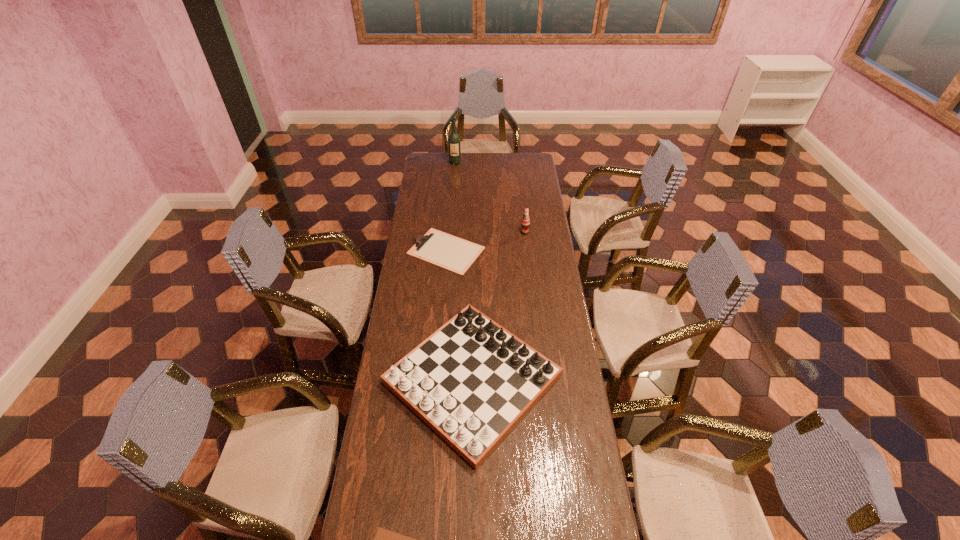
I want to click on object present at the far edge, so click(454, 140).

This screenshot has width=960, height=540. I want to click on gameboard that is at the left edge, so click(472, 381).

Where is `clipboard at the left edge`? This screenshot has height=540, width=960. clipboard at the left edge is located at coordinates (447, 251).

Image resolution: width=960 pixels, height=540 pixels. In order to click on soda that is at the right edge in this screenshot , I will do `click(525, 222)`.

Where is `gameboard that is at the right edge`? The image size is (960, 540). gameboard that is at the right edge is located at coordinates (472, 381).

In order to click on free location at the left edge of the desktop in this screenshot , I will do `click(443, 177)`.

Identify the location of blank space at the right edge. (526, 186).

This screenshot has width=960, height=540. I want to click on free space at the far left corner, so click(441, 169).

Where is `free space between the soda and the gameboard`? The image size is (960, 540). free space between the soda and the gameboard is located at coordinates (498, 306).

I want to click on free point between the farther clipboard and the soda, so click(486, 241).